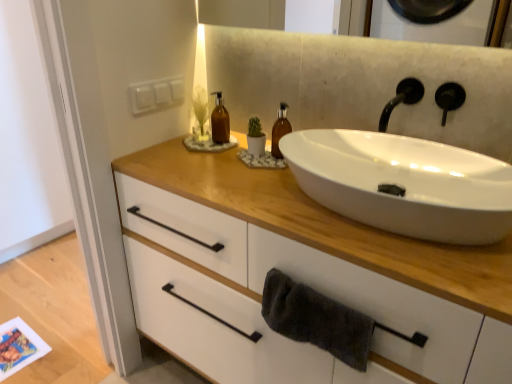
Question: From a real-world perspective, is white matte cabinet at center physically above black matte tap at upper right?

Choices:
 (A) no
 (B) yes

Answer: (A)

Question: Is the depth of white matte cabinet at center greater than that of black matte tap at upper right?

Choices:
 (A) no
 (B) yes

Answer: (A)

Question: Is white matte cabinet at center bigger than black matte tap at upper right?

Choices:
 (A) no
 (B) yes

Answer: (B)

Question: Is black matte tap at upper right inside white matte cabinet at center?

Choices:
 (A) yes
 (B) no

Answer: (B)

Question: Considering the relative sizes of white matte cabinet at center and black matte tap at upper right in the image provided, is white matte cabinet at center taller than black matte tap at upper right?

Choices:
 (A) yes
 (B) no

Answer: (A)

Question: Is dark gray towel at lower center inside the boundaries of black matte tap at upper right, or outside?

Choices:
 (A) inside
 (B) outside

Answer: (B)

Question: Visually, is dark gray towel at lower center positioned to the left or to the right of black matte tap at upper right?

Choices:
 (A) right
 (B) left

Answer: (B)

Question: Is point (327, 336) positioned closer to the camera than point (415, 86)?

Choices:
 (A) farther
 (B) closer

Answer: (B)

Question: Is dark gray towel at lower center wider or thinner than black matte tap at upper right?

Choices:
 (A) thin
 (B) wide

Answer: (A)

Question: Considering the positions of point (224, 129) and point (412, 317), is point (224, 129) closer or farther from the camera than point (412, 317)?

Choices:
 (A) farther
 (B) closer

Answer: (A)

Question: In terms of height, does brown glass bottle at center, the first bottle viewed from the left, look taller or shorter compared to white matte cabinet at center?

Choices:
 (A) tall
 (B) short

Answer: (B)

Question: From the image's perspective, is brown glass bottle at center, acting as the second bottle starting from the right, above or below white matte cabinet at center?

Choices:
 (A) below
 (B) above

Answer: (B)

Question: Would you say brown glass bottle at center, acting as the second bottle starting from the right, is inside or outside white matte cabinet at center?

Choices:
 (A) outside
 (B) inside

Answer: (A)

Question: In terms of size, does dark gray towel at lower center appear bigger or smaller than translucent amber bottle at center, the first bottle when ordered from right to left?

Choices:
 (A) big
 (B) small

Answer: (A)

Question: Is dark gray towel at lower center situated inside translucent amber bottle at center, which is the second bottle in left-to-right order, or outside?

Choices:
 (A) inside
 (B) outside

Answer: (B)